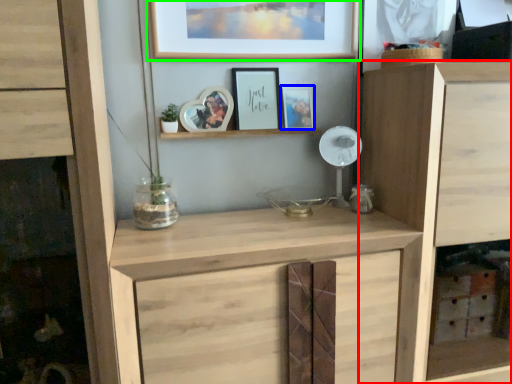
Question: Considering the real-world distances, which object is closest to cupboard (highlighted by a red box)? picture frame (highlighted by a blue box) or picture frame (highlighted by a green box).

Choices:
 (A) picture frame
 (B) picture frame

Answer: (A)